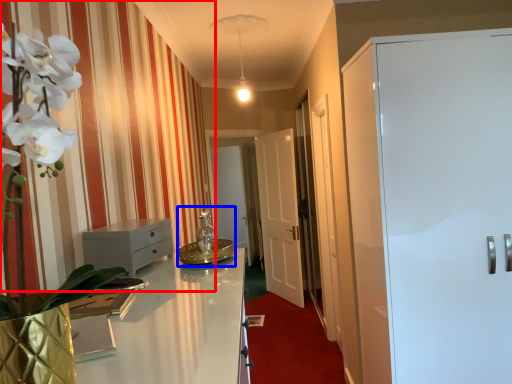
Question: Which of the following is the closest to the observer, curtain (highlighted by a red box) or sink (highlighted by a blue box)?

Choices:
 (A) curtain
 (B) sink

Answer: (A)